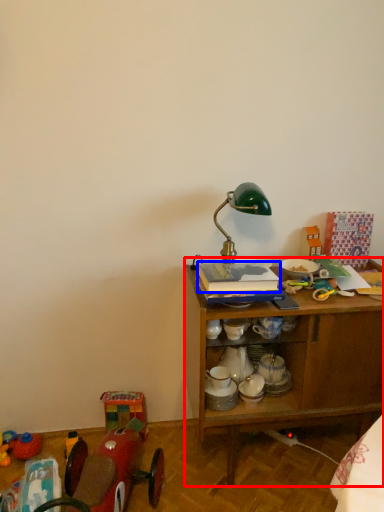
Question: Which object is closer to the camera taking this photo, desk (highlighted by a red box) or book (highlighted by a blue box)?

Choices:
 (A) desk
 (B) book

Answer: (B)